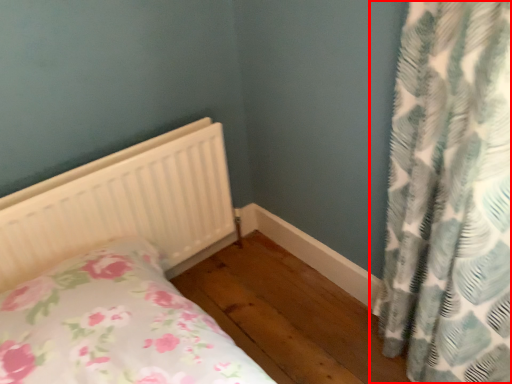
Question: From the image, what is the correct spatial relationship of curtain (annotated by the red box) in relation to bed?

Choices:
 (A) right
 (B) left

Answer: (A)